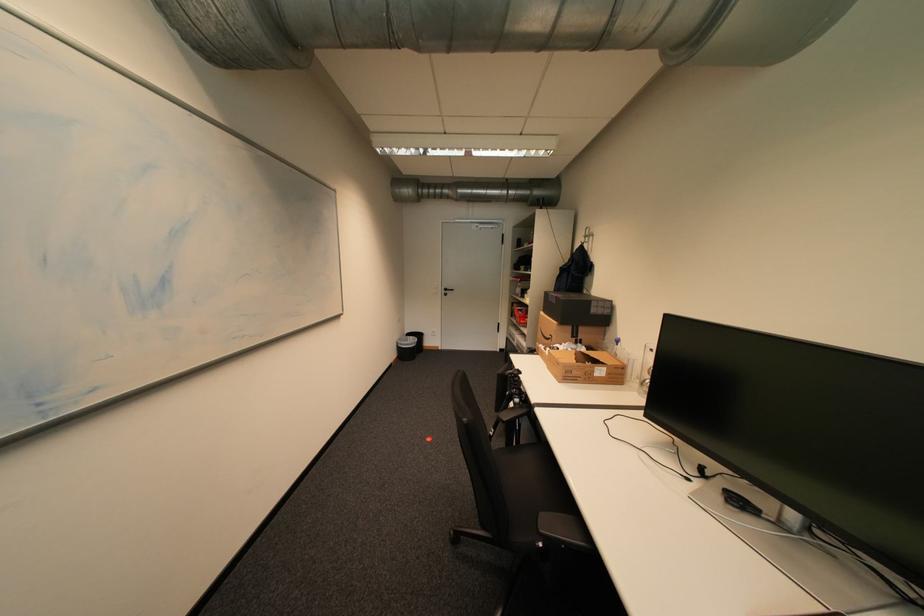
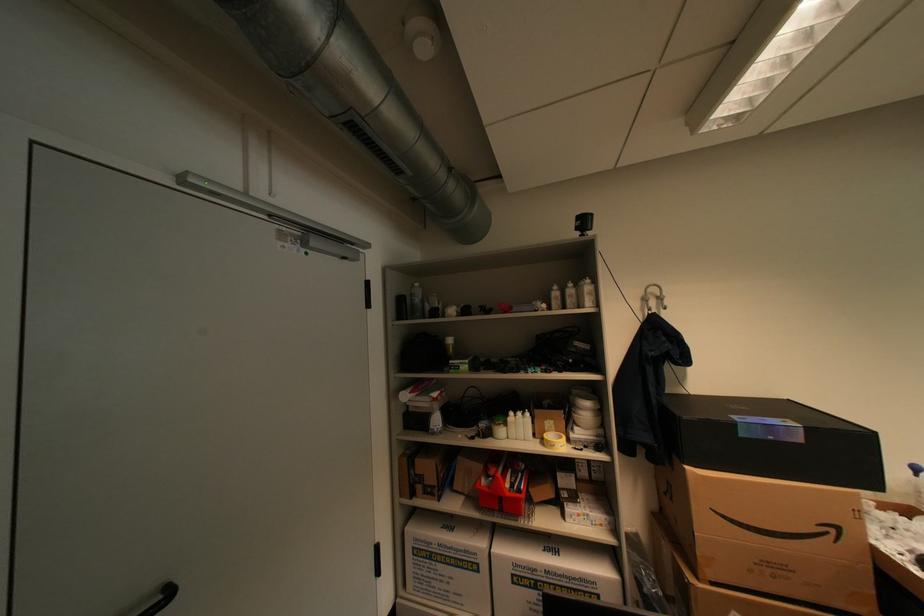
Find the pixel in the second image that matches pixel 518 336 in the first image.

(439, 556)